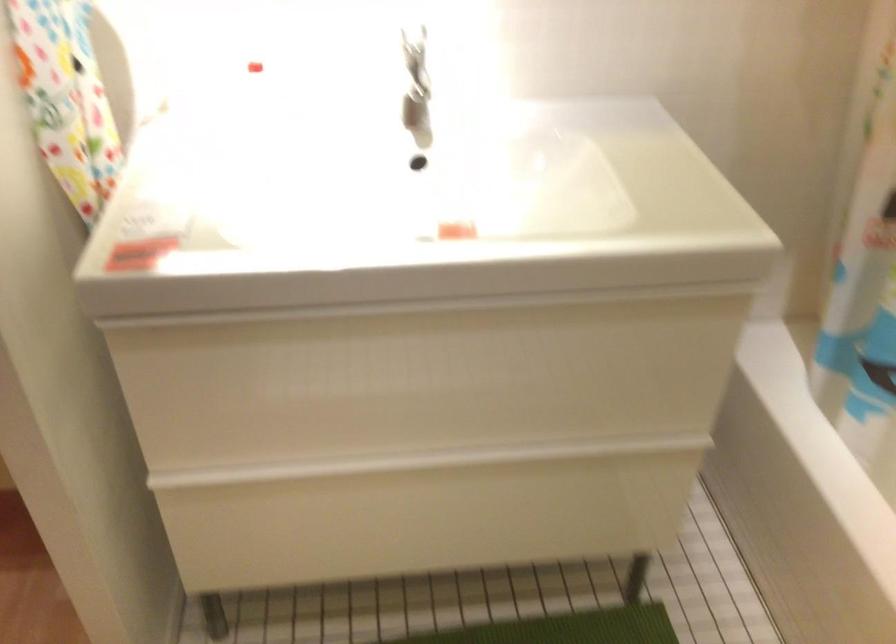
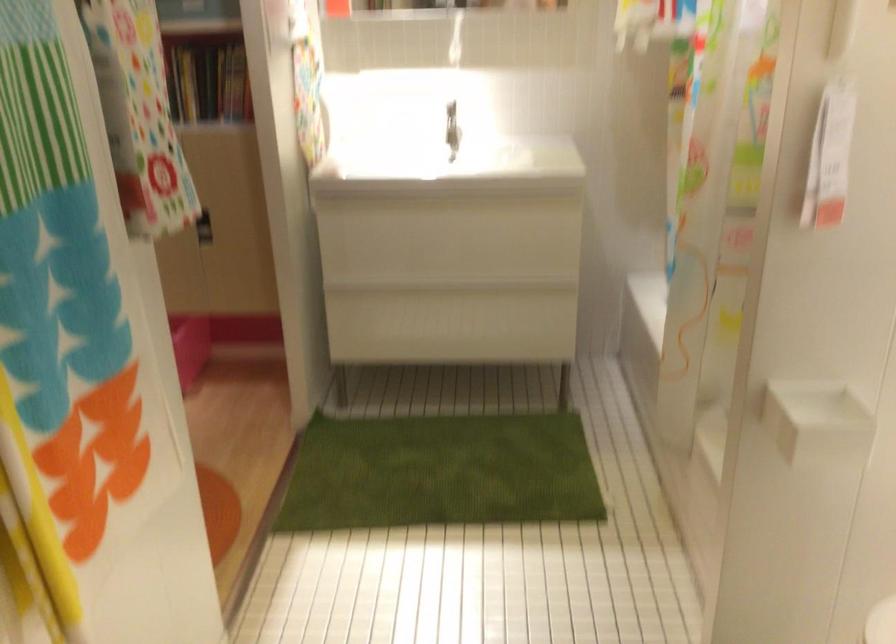
Locate, in the second image, the point that corresponds to point (419, 313) in the first image.

(440, 201)